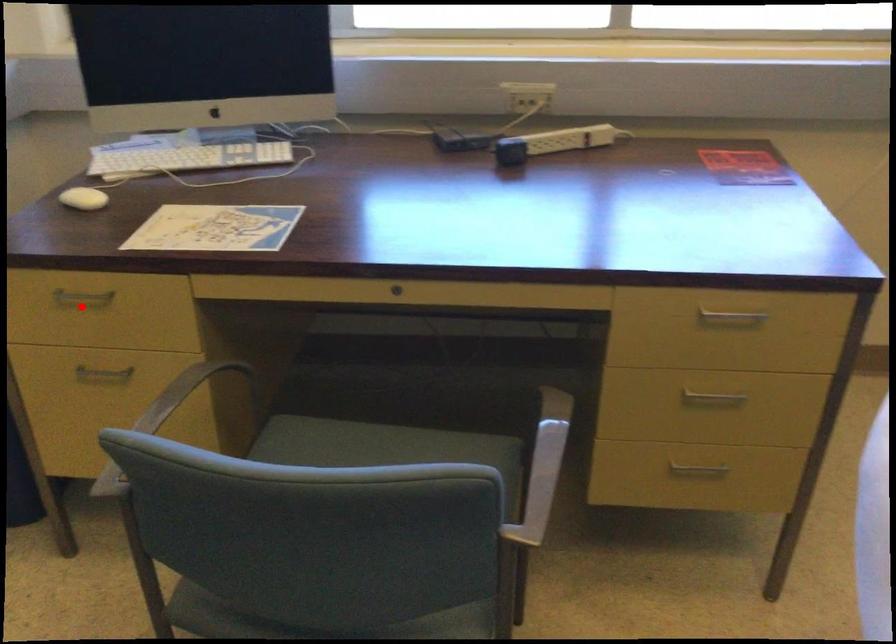
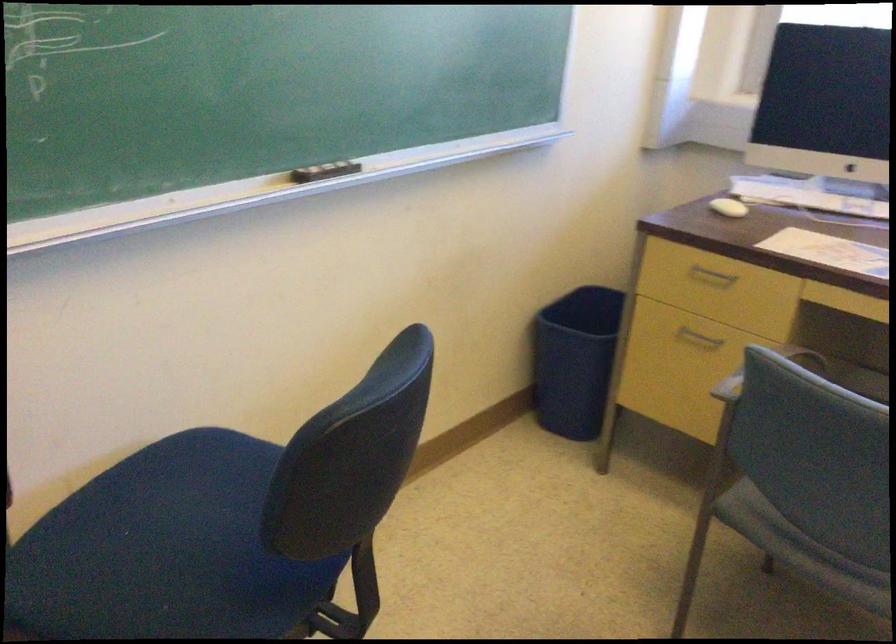
Question: I am providing you with two images of the same scene from different viewpoints. Image1 has a red point marked. In image2, the corresponding 3D location appears at what relative position? Reply with the corresponding letter.

Choices:
 (A) Closer
 (B) Farther

Answer: (B)